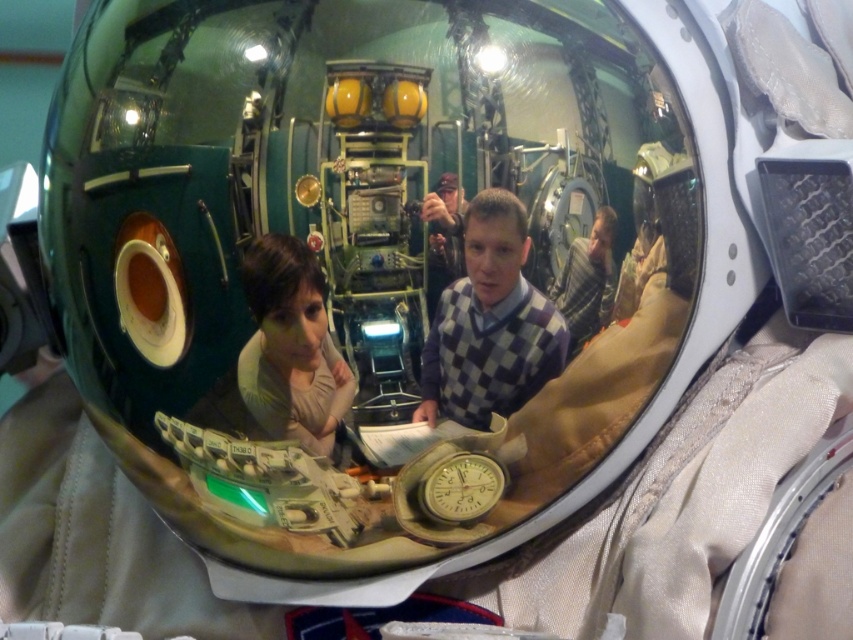
Question: Which object is closer to the camera taking this photo?

Choices:
 (A) matte beige shirt at center
 (B) checkered sweater at center

Answer: (A)

Question: Which object appears closest to the camera in this image?

Choices:
 (A) purple checkered sweater at center
 (B) checkered sweater at center
 (C) matte beige shirt at center

Answer: (A)

Question: Does matte beige shirt at center appear under checkered sweater at center?

Choices:
 (A) no
 (B) yes

Answer: (B)

Question: Can you confirm if matte beige shirt at center is positioned to the right of checkered sweater at center?

Choices:
 (A) yes
 (B) no

Answer: (B)

Question: Can you confirm if purple checkered sweater at center is positioned above matte beige shirt at center?

Choices:
 (A) no
 (B) yes

Answer: (B)

Question: Which point appears closest to the camera in this image?

Choices:
 (A) (271, 429)
 (B) (490, 228)

Answer: (B)